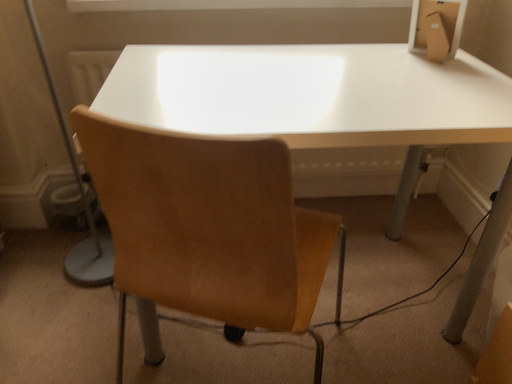
The image size is (512, 384). Identify the location of vacant region to the left of brown cardboard box at upper right. (375, 62).